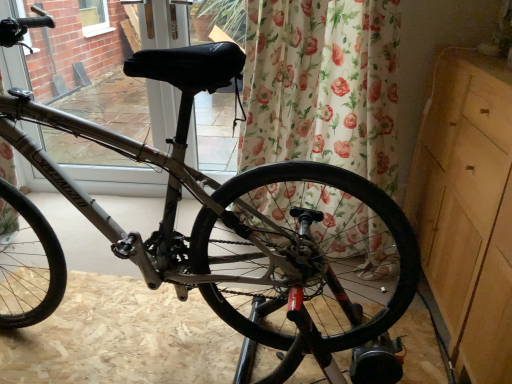
Question: Is light wood dresser at right in contact with floral fabric curtain at center?

Choices:
 (A) yes
 (B) no

Answer: (B)

Question: Does light wood dresser at right have a lesser height compared to floral fabric curtain at center?

Choices:
 (A) yes
 (B) no

Answer: (B)

Question: Does light wood dresser at right lie behind floral fabric curtain at center?

Choices:
 (A) no
 (B) yes

Answer: (A)

Question: Is light wood dresser at right at the left side of floral fabric curtain at center?

Choices:
 (A) yes
 (B) no

Answer: (B)

Question: Considering the relative sizes of light wood dresser at right and floral fabric curtain at center in the image provided, is light wood dresser at right thinner than floral fabric curtain at center?

Choices:
 (A) no
 (B) yes

Answer: (A)

Question: Can floral fabric curtain at center be found inside light wood dresser at right?

Choices:
 (A) yes
 (B) no

Answer: (B)

Question: Does light wood dresser at right have a lesser height compared to black rubber tire at center?

Choices:
 (A) no
 (B) yes

Answer: (A)

Question: From a real-world perspective, is light wood dresser at right under black rubber tire at center?

Choices:
 (A) no
 (B) yes

Answer: (A)

Question: Does light wood dresser at right appear on the left side of black rubber tire at center?

Choices:
 (A) no
 (B) yes

Answer: (A)

Question: Is light wood dresser at right outside of black rubber tire at center?

Choices:
 (A) yes
 (B) no

Answer: (A)

Question: From the image's perspective, is light wood dresser at right located beneath black rubber tire at center?

Choices:
 (A) no
 (B) yes

Answer: (A)

Question: Can black rubber tire at center be found inside light wood dresser at right?

Choices:
 (A) yes
 (B) no

Answer: (B)

Question: Can we say black leather seat at upper center lies outside floral fabric curtain at center?

Choices:
 (A) no
 (B) yes

Answer: (B)